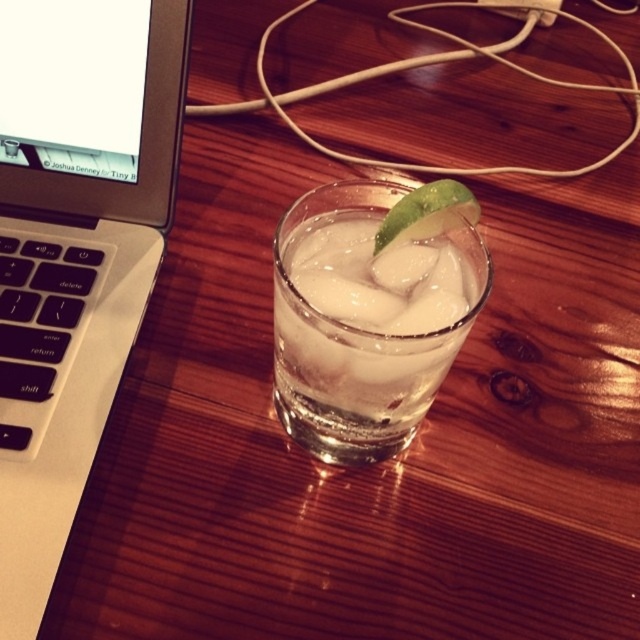
Can you confirm if silver metallic laptop at left is thinner than green matte lime at center?

No.

Consider the image. Which is below, silver metallic laptop at left or green matte lime at center?

silver metallic laptop at left is below.

At what (x,y) coordinates should I click in order to perform the action: click on silver metallic laptop at left. Please return your answer as a coordinate pair (x, y). The width and height of the screenshot is (640, 640). Looking at the image, I should click on (74, 250).

Does silver metallic laptop at left have a greater height compared to clear glass ice at center?

Correct, silver metallic laptop at left is much taller as clear glass ice at center.

What are the coordinates of `silver metallic laptop at left` in the screenshot? It's located at (74, 250).

Which is more to the left, clear glass ice at center or green matte lime at center?

clear glass ice at center is more to the left.

Is point (275, 388) less distant than point (410, 221)?

That is False.

Between point (280, 372) and point (445, 216), which one is positioned behind?

The point (280, 372) is behind.

Find the location of a particular element. clear glass ice at center is located at coordinates (356, 342).